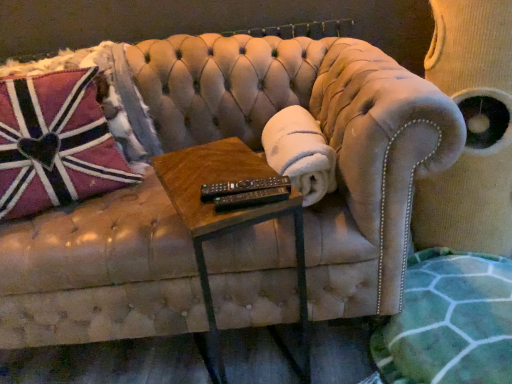
You are a GUI agent. You are given a task and a screenshot of the screen. Output one action in this format:
    pyautogui.click(x=<x>, y=<y>)
    Task: Click on the vacant space situated on the left part of black plastic remote at center
    
    Given the screenshot: What is the action you would take?
    pyautogui.click(x=190, y=188)